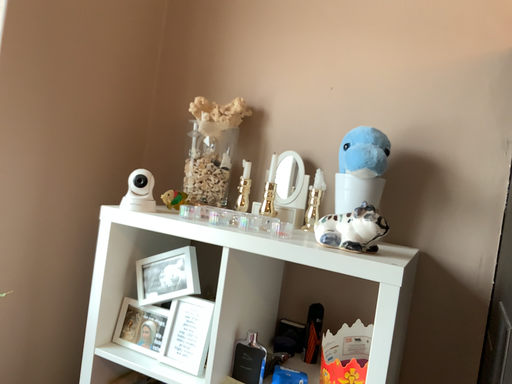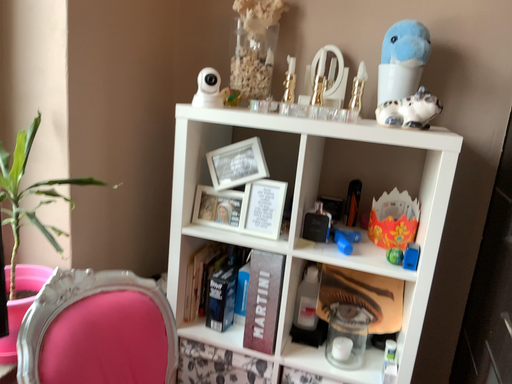
Question: Which way did the camera rotate in the video?

Choices:
 (A) rotated left
 (B) rotated right

Answer: (B)